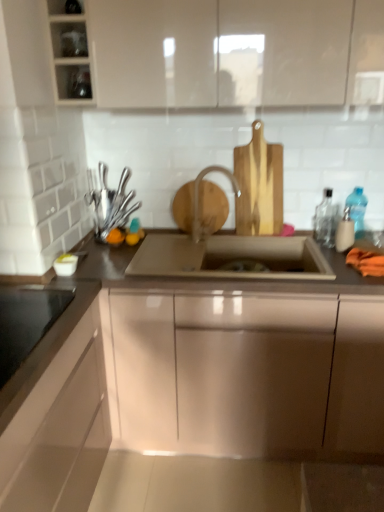
The height and width of the screenshot is (512, 384). In order to click on matte white cabinet at upper center, arranged as the third cabinetry when ordered from the bottom in this screenshot , I will do `click(236, 52)`.

Describe the element at coordinates (70, 52) in the screenshot. I see `transparent glass jars at upper left, which is the first shelf from bottom to top` at that location.

How much space does glossy metallic sink at center, the 2th cabinetry when ordered from bottom to top, occupy vertically?

It is 36.03 inches.

Find the location of a particular element. This screenshot has width=384, height=512. black glass cooktop at lower left, arranged as the 1th appliance when ordered from the bottom is located at coordinates (26, 322).

Where is `satin nickel faucet at center`? Image resolution: width=384 pixels, height=512 pixels. satin nickel faucet at center is located at coordinates (198, 194).

Which bottle is the 2nd one when counting from the right side of the transparent glass jar at upper left, acting as the 2th shelf starting from the bottom? Please provide its 2D coordinates.

[(345, 232)]

Is transparent glass jar at upper left, arranged as the first shelf when viewed from the top, turned away from translucent plastic soap dispenser at right, which is the 2th bottle in left-to-right order?

No, transparent glass jar at upper left, arranged as the first shelf when viewed from the top,'s orientation is not away from translucent plastic soap dispenser at right, which is the 2th bottle in left-to-right order.

Can translucent plastic soap dispenser at right, which is the 2th bottle in left-to-right order, be found inside transparent glass jar at upper left, arranged as the first shelf when viewed from the top?

No.

Is transparent glass jar at upper left, acting as the 2th shelf starting from the bottom, further to camera compared to translucent plastic soap dispenser at right, which appears as the second bottle when viewed from the right?

No, transparent glass jar at upper left, acting as the 2th shelf starting from the bottom, is closer to the viewer.

Is satin nickel faucet at center at the left side of satin silver cutlery at left, which appears as the 2th appliance when ordered from the bottom?

In fact, satin nickel faucet at center is to the right of satin silver cutlery at left, which appears as the 2th appliance when ordered from the bottom.

From a real-world perspective, between satin nickel faucet at center and satin silver cutlery at left, the 2th appliance from the left, who is vertically higher?

From a 3D spatial view, satin silver cutlery at left, the 2th appliance from the left, is above.

In the scene shown: Which of these two, satin nickel faucet at center or satin silver cutlery at left, the 2th appliance from the left, stands taller?

With more height is satin nickel faucet at center.

Is satin nickel faucet at center positioned with its back to satin silver cutlery at left, which appears as the 2th appliance when ordered from the bottom?

No, satin silver cutlery at left, which appears as the 2th appliance when ordered from the bottom, is not at the back of satin nickel faucet at center.

Is translucent plastic soap dispenser at right, which is the 2th bottle in left-to-right order, placed right next to transparent glass jars at upper left, positioned as the second shelf in top-to-bottom order?

No, translucent plastic soap dispenser at right, which is the 2th bottle in left-to-right order, is not next to transparent glass jars at upper left, positioned as the second shelf in top-to-bottom order.

Is translucent plastic soap dispenser at right, which is the 2th bottle in left-to-right order, taller or shorter than transparent glass jars at upper left, which is the first shelf from bottom to top?

Considering their sizes, translucent plastic soap dispenser at right, which is the 2th bottle in left-to-right order, has less height than transparent glass jars at upper left, which is the first shelf from bottom to top.

Is transparent glass jars at upper left, positioned as the second shelf in top-to-bottom order, at the back of translucent plastic soap dispenser at right, which appears as the second bottle when viewed from the right?

That's not correct — translucent plastic soap dispenser at right, which appears as the second bottle when viewed from the right, is not looking away from transparent glass jars at upper left, positioned as the second shelf in top-to-bottom order.

From the image's perspective, which is below, transparent plastic bottle at right, marked as the 3th bottle in a right-to-left arrangement, or glossy metallic sink at center, which is counted as the second cabinetry, starting from the top?

From the image's view, glossy metallic sink at center, which is counted as the second cabinetry, starting from the top, is below.

Considering the relative sizes of transparent plastic bottle at right, marked as the 3th bottle in a right-to-left arrangement, and glossy metallic sink at center, the 2th cabinetry when ordered from bottom to top, in the image provided, is transparent plastic bottle at right, marked as the 3th bottle in a right-to-left arrangement, taller than glossy metallic sink at center, the 2th cabinetry when ordered from bottom to top,?

No, transparent plastic bottle at right, marked as the 3th bottle in a right-to-left arrangement, is not taller than glossy metallic sink at center, the 2th cabinetry when ordered from bottom to top.

Between transparent plastic bottle at right, marked as the 3th bottle in a right-to-left arrangement, and glossy metallic sink at center, the 2th cabinetry when ordered from bottom to top, which one has larger size?

glossy metallic sink at center, the 2th cabinetry when ordered from bottom to top.

From a real-world perspective, is transparent plastic bottle at right, which appears as the first bottle when viewed from the left, physically above glossy metallic sink at center, the 2th cabinetry when ordered from bottom to top?

Yes, from a real-world perspective, transparent plastic bottle at right, which appears as the first bottle when viewed from the left, is over glossy metallic sink at center, the 2th cabinetry when ordered from bottom to top

Does glossy metallic sink at center, which is counted as the second cabinetry, starting from the top, appear on the left side of transparent plastic bottle at right, which appears as the 1th bottle when viewed from the right?

Yes.

Do you think glossy metallic sink at center, which is counted as the second cabinetry, starting from the top, is within transparent plastic bottle at right, the third bottle from the left, or outside of it?

glossy metallic sink at center, which is counted as the second cabinetry, starting from the top, is not inside transparent plastic bottle at right, the third bottle from the left, it's outside.

Is glossy metallic sink at center, which is counted as the second cabinetry, starting from the top, shorter than transparent plastic bottle at right, the third bottle from the left?

In fact, glossy metallic sink at center, which is counted as the second cabinetry, starting from the top, may be taller than transparent plastic bottle at right, the third bottle from the left.

Looking at this image, would you consider glossy metallic sink at center, the 2th cabinetry when ordered from bottom to top, to be distant from transparent plastic bottle at right, which appears as the 1th bottle when viewed from the right?

Yes.

Considering their positions, is satin nickel faucet at center located in front of or behind glossy beige cabinet at lower left, the third cabinetry positioned from the top?

satin nickel faucet at center is behind glossy beige cabinet at lower left, the third cabinetry positioned from the top.

Is glossy beige cabinet at lower left, which is counted as the first cabinetry, starting from the bottom, surrounded by satin nickel faucet at center?

No, satin nickel faucet at center does not contain glossy beige cabinet at lower left, which is counted as the first cabinetry, starting from the bottom.

Could you tell me if satin nickel faucet at center is facing glossy beige cabinet at lower left, the third cabinetry positioned from the top?

No, satin nickel faucet at center is not turned towards glossy beige cabinet at lower left, the third cabinetry positioned from the top.

Is satin nickel faucet at center to the left of glossy beige cabinet at lower left, which is counted as the first cabinetry, starting from the bottom, from the viewer's perspective?

No, satin nickel faucet at center is not to the left of glossy beige cabinet at lower left, which is counted as the first cabinetry, starting from the bottom.

Find the location of `cabinetry that is the 3rd one when counting downward from the transparent glass jar at upper left, acting as the 2th shelf starting from the bottom (from the image's perspective)`. cabinetry that is the 3rd one when counting downward from the transparent glass jar at upper left, acting as the 2th shelf starting from the bottom (from the image's perspective) is located at coordinates (60, 429).

From the image's perspective, is glossy beige cabinet at lower left, the third cabinetry positioned from the top, above or below transparent glass jar at upper left, arranged as the first shelf when viewed from the top?

Based on their image positions, glossy beige cabinet at lower left, the third cabinetry positioned from the top, is located beneath transparent glass jar at upper left, arranged as the first shelf when viewed from the top.

Is glossy beige cabinet at lower left, the third cabinetry positioned from the top, far away from transparent glass jar at upper left, arranged as the first shelf when viewed from the top?

Yes, glossy beige cabinet at lower left, the third cabinetry positioned from the top, and transparent glass jar at upper left, arranged as the first shelf when viewed from the top, are quite far apart.

There is a translucent plastic soap dispenser at right, which appears as the second bottle when viewed from the right. Identify the location of the 2nd shelf above it (from a real-world perspective). (69, 39).

The height and width of the screenshot is (512, 384). Identify the location of tap in front of the satin silver cutlery at left, which is the first appliance in back-to-front order. (198, 194).

Which object lies nearer to the anchor point glossy beige cabinet at lower left, the third cabinetry positioned from the top, satin silver cutlery at left, which appears as the 2th appliance when ordered from the bottom, or satin nickel sink at center?

satin nickel sink at center lies closer to glossy beige cabinet at lower left, the third cabinetry positioned from the top, than the other object.

Estimate the real-world distances between objects in this image. Which object is closer to transparent plastic bottle at right, the third bottle from the left, matte white cabinet at upper center, arranged as the third cabinetry when ordered from the bottom, or satin nickel faucet at center?

satin nickel faucet at center is positioned closer to the anchor transparent plastic bottle at right, the third bottle from the left.

From the image, which object appears to be nearer to matte white cabinet at upper center, which is counted as the 1th cabinetry, starting from the top, transparent plastic bottle at right, the third bottle from the left, or glossy metallic sink at center, which is counted as the second cabinetry, starting from the top?

transparent plastic bottle at right, the third bottle from the left.

When comparing their distances from transparent glass jars at upper left, positioned as the second shelf in top-to-bottom order, does transparent glass jar at upper left, acting as the 2th shelf starting from the bottom, or transparent plastic bottle at right, the third bottle from the left, seem further?

Based on the image, transparent plastic bottle at right, the third bottle from the left, appears to be further to transparent glass jars at upper left, positioned as the second shelf in top-to-bottom order.

Considering their positions, is transparent plastic bottle at right, the third bottle from the left, positioned further to transparent glass jars at upper left, positioned as the second shelf in top-to-bottom order, than glossy metallic sink at center, the 2th cabinetry when ordered from bottom to top?

transparent plastic bottle at right, the third bottle from the left, lies further to transparent glass jars at upper left, positioned as the second shelf in top-to-bottom order, than the other object.

Which object lies nearer to the anchor point glossy metallic sink at center, which is counted as the second cabinetry, starting from the top, transparent glass jar at upper left, arranged as the first shelf when viewed from the top, or translucent plastic soap dispenser at right, which appears as the second bottle when viewed from the right?

translucent plastic soap dispenser at right, which appears as the second bottle when viewed from the right, is closer to glossy metallic sink at center, which is counted as the second cabinetry, starting from the top.

Which object lies further to the anchor point black glass cooktop at lower left, arranged as the second appliance when viewed from the right, transparent glass jar at upper left, arranged as the first shelf when viewed from the top, or transparent plastic bottle at right, the third bottle from the left?

transparent plastic bottle at right, the third bottle from the left, is positioned further to the anchor black glass cooktop at lower left, arranged as the second appliance when viewed from the right.

Based on their spatial positions, is satin silver cutlery at left, the 2th appliance from the left, or satin nickel faucet at center further from translucent plastic soap dispenser at right, which appears as the second bottle when viewed from the right?

satin silver cutlery at left, the 2th appliance from the left, lies further to translucent plastic soap dispenser at right, which appears as the second bottle when viewed from the right, than the other object.

This screenshot has height=512, width=384. Identify the location of appliance located between glossy beige cabinet at lower left, which is counted as the first cabinetry, starting from the bottom, and satin silver cutlery at left, the second appliance viewed from the front, in the depth direction. (26, 322).

I want to click on shelf between transparent glass jar at upper left, arranged as the first shelf when viewed from the top, and glossy beige cabinet at lower left, which is counted as the first cabinetry, starting from the bottom, from top to bottom, so click(70, 52).

The height and width of the screenshot is (512, 384). I want to click on tap between transparent glass jar at upper left, arranged as the first shelf when viewed from the top, and matte white cabinet at upper center, arranged as the third cabinetry when ordered from the bottom, from left to right, so click(x=198, y=194).

Identify the location of tap located between black glass cooktop at lower left, which appears as the second appliance when viewed from the top, and satin silver cutlery at left, the 2th appliance from the left, in the depth direction. (198, 194).